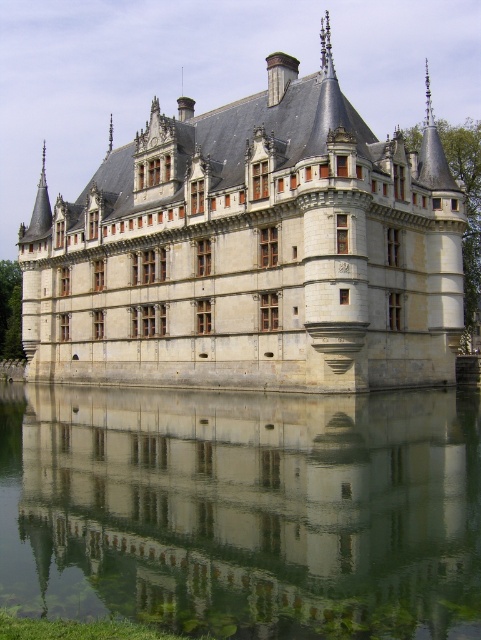
You are a tourist visiting the historic site and want to take a photo of the stone castle at center and the transparent glass water at center. Which object should you focus on first if you want to capture both in a single frame without moving the camera?

The stone castle at center is much taller than the transparent glass water at center, so you should focus on the stone castle at center first to ensure its full height is captured in the frame.

You are standing in front of a historic building and see the stone castle at center and the transparent glass water at center. Which object is closer to you?

The stone castle at center is closer to you than the transparent glass water at center because it is positioned further away from the viewer.

You are standing in front of the historic building and want to place a small statue exactly at the point marked by coordinates point (252,250). Based on the scene description, where on the building would this point be located?

The point (252,250) is located on the stone castle at center, so the statue should be placed on the central section of the castle.